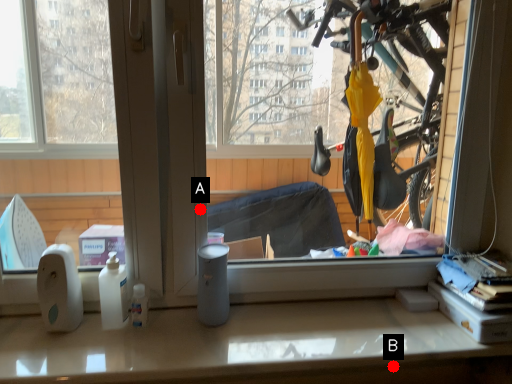
Question: Two points are circled on the image, labeled by A and B beside each circle. Which point is closer to the camera?

Choices:
 (A) A is closer
 (B) B is closer

Answer: (B)